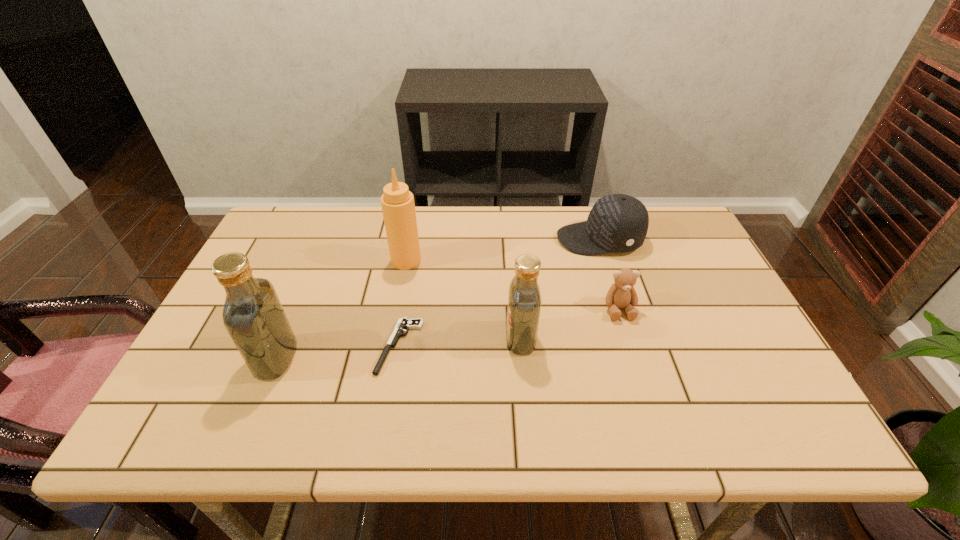
At what (x,y) coordinates should I click in order to perform the action: click on vacant region located 0.060m on the front-facing side of the fourth shortest object. Please return your answer as a coordinate pair (x, y). This screenshot has height=540, width=960. Looking at the image, I should click on (482, 339).

Find the location of `vacant space located on the right of the condiment`. vacant space located on the right of the condiment is located at coordinates [554, 260].

I want to click on free space located at the front of the baseball cap where the brim is located, so click(x=534, y=239).

The image size is (960, 540). In order to click on vacant space situated 0.130m at the front of the baseball cap where the brim is located in this screenshot , I will do `click(515, 239)`.

Identify the location of vacant position located 0.090m at the front of the baseball cap where the brim is located. (528, 239).

Locate an element on the screen. vacant point located 0.060m on the front-facing side of the pistol is located at coordinates (353, 346).

At what (x,y) coordinates should I click in order to perform the action: click on vacant region located on the front-facing side of the pistol. Please return your answer as a coordinate pair (x, y). Looking at the image, I should click on (233, 346).

The height and width of the screenshot is (540, 960). I want to click on vacant space located 0.310m on the front-facing side of the pistol, so click(250, 346).

Where is `blank space located 0.100m on the face of the teddy bear`? blank space located 0.100m on the face of the teddy bear is located at coordinates (634, 354).

What are the coordinates of `condiment that is positioned at the far edge` in the screenshot? It's located at (398, 207).